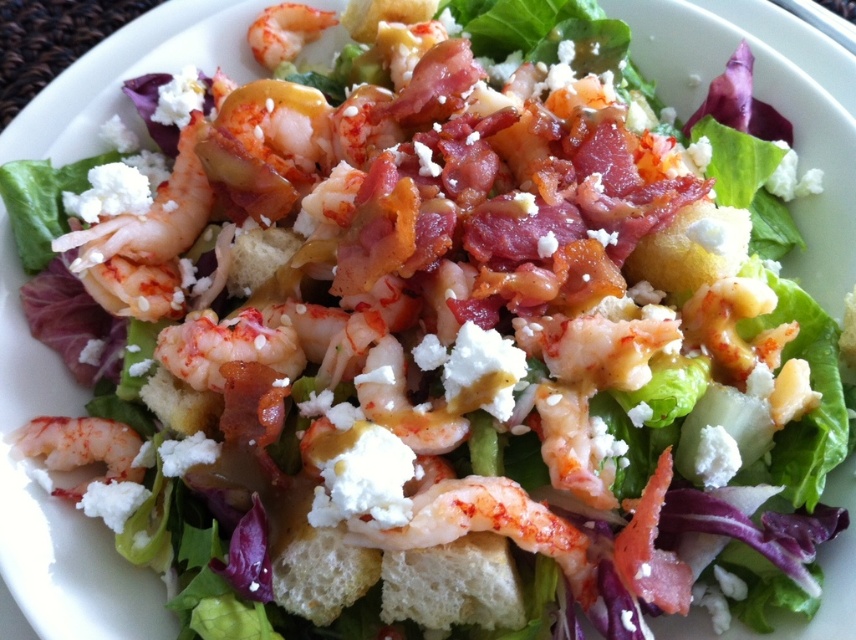
You are a chef preparing a salad and want to arrange the white crumbly shrimp at center and white crumbly cheese at center on a plate. Based on their sizes, which one should you place first to ensure proper spacing?

The white crumbly shrimp at center is wider than the white crumbly cheese at center, so you should place the shrimp first to account for its larger size and ensure proper spacing.